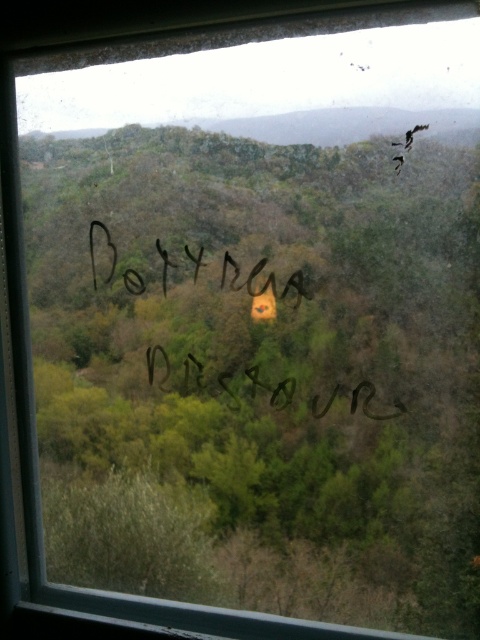
You are an artist trying to capture the view outside the window but want to avoid including the black ink writing at center in your painting. Based on its position, where should you focus your painting to exclude it?

The black ink writing at center is located at point [356,401], so to exclude it, focus on areas of the scene outside those coordinates, such as the upper left or lower right sections of the window view.

You are a visitor trying to read the words written on the window. You see the black ink writing at center and the black marker writing at center. Which one is positioned more to the right?

The black ink writing at center is positioned more to the right than the black marker writing at center.

You are standing inside a room looking through a slightly dirty window. You notice two points marked on the window glass. The first point is at coordinates point (186, 380) and the second is at point (299, 305). Which point is closer to you?

Point (186, 380) is closer to you because it is further to the viewer than point (299, 305).